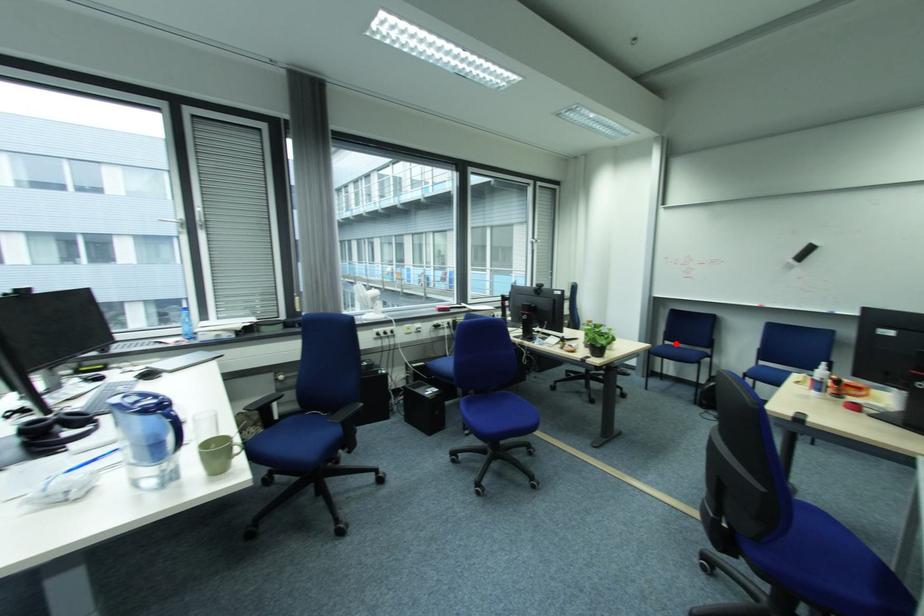
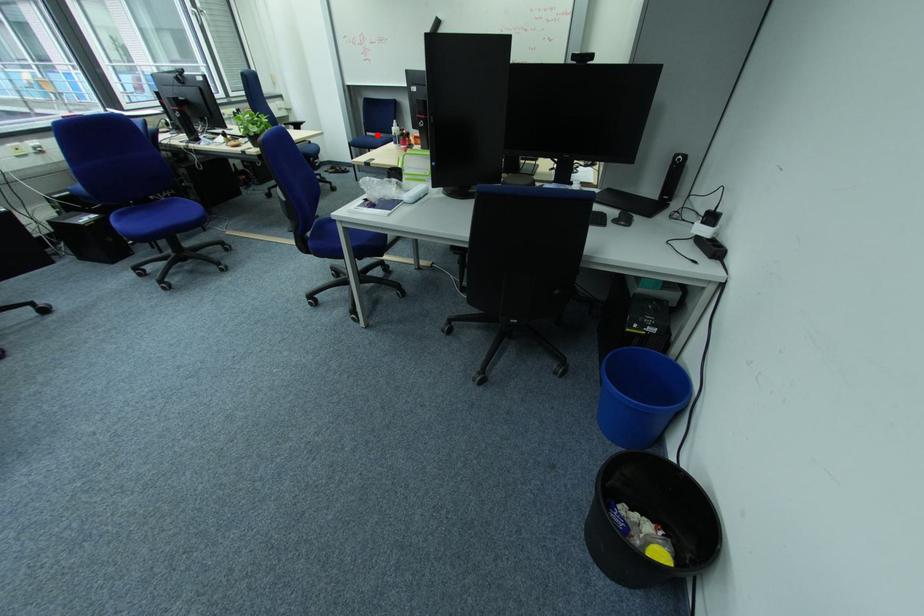
I am providing you with two images of the same scene from different viewpoints. A red point is marked on the first image and another point is marked on the second image. Are the points marked in image1 and image2 representing the same 3D position?

Yes